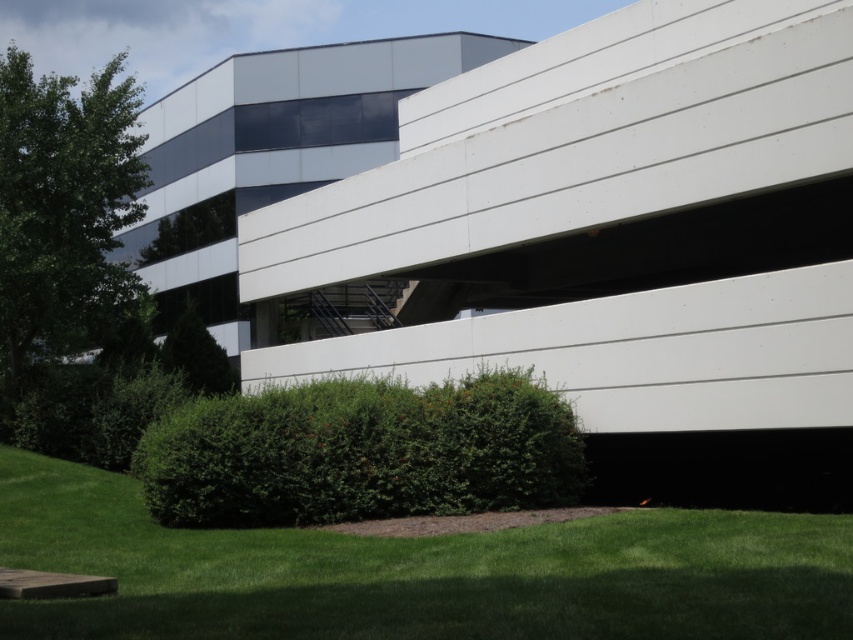
Does green leafy bush at lower center have a lesser height compared to green leafy tree at left?

Correct, green leafy bush at lower center is not as tall as green leafy tree at left.

From the picture: Who is more forward, (201, 397) or (125, 195)?

Point (201, 397) is more forward.

The image size is (853, 640). In order to click on green leafy bush at lower center in this screenshot , I will do `click(361, 452)`.